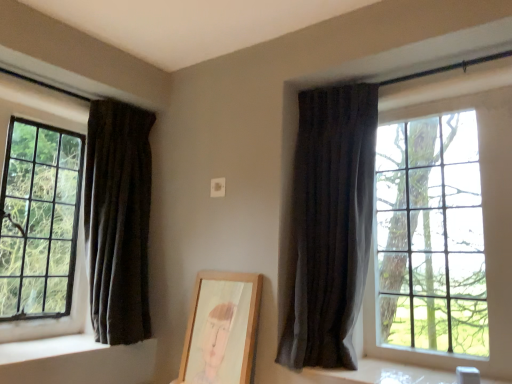
This screenshot has width=512, height=384. What do you see at coordinates (118, 220) in the screenshot? I see `dark fabric curtain at left, which is the second curtain in right-to-left order` at bounding box center [118, 220].

In order to click on dark fabric curtain at left, arranged as the 1th curtain when viewed from the left in this screenshot , I will do `click(118, 220)`.

What is the approximate width of matte black window at left, which ranks as the 1th window in left-to-right order?

matte black window at left, which ranks as the 1th window in left-to-right order, is 3.43 inches wide.

What do you see at coordinates (327, 227) in the screenshot? This screenshot has width=512, height=384. I see `dark fabric curtain at right, marked as the second curtain in a left-to-right arrangement` at bounding box center [327, 227].

Find the location of a particular element. Image resolution: width=512 pixels, height=384 pixels. wooden picture frame at center is located at coordinates (222, 328).

You are a GUI agent. You are given a task and a screenshot of the screen. Output one action in this format:
    pyautogui.click(x=<x>, y=<y>)
    Task: Click on the white smooth window sill at lower right, positioned as the second window sill in left-to-right order
    
    Given the screenshot: What is the action you would take?
    pyautogui.click(x=383, y=374)

Is clear glass window at right, which appears as the 1th window when viewed from the right, turned away from white smooth window sill at lower right, positioned as the second window sill in left-to-right order?

clear glass window at right, which appears as the 1th window when viewed from the right, does not have its back to white smooth window sill at lower right, positioned as the second window sill in left-to-right order.

Which object is positioned more to the right, clear glass window at right, which appears as the 1th window when viewed from the right, or white smooth window sill at lower right, positioned as the second window sill in left-to-right order?

clear glass window at right, which appears as the 1th window when viewed from the right, is more to the right.

Is there a large distance between clear glass window at right, the 2th window from the left, and white smooth window sill at lower right, the first window sill positioned from the right?

No, clear glass window at right, the 2th window from the left, is in close proximity to white smooth window sill at lower right, the first window sill positioned from the right.

Between matte black window at left, placed as the second window when sorted from right to left, and wooden picture frame at center, which one is positioned in front?

wooden picture frame at center is in front.

This screenshot has width=512, height=384. Find the location of `picture frame on the right of matte black window at left, which ranks as the 1th window in left-to-right order`. picture frame on the right of matte black window at left, which ranks as the 1th window in left-to-right order is located at coordinates (222, 328).

Does matte black window at left, which ranks as the 1th window in left-to-right order, have a larger size compared to wooden picture frame at center?

Correct, matte black window at left, which ranks as the 1th window in left-to-right order, is larger in size than wooden picture frame at center.

Is matte black window at left, placed as the second window when sorted from right to left, at the right side of wooden picture frame at center?

No.

Considering the positions of objects white smooth window sill at lower left, which is the first window sill in left-to-right order, and dark fabric curtain at left, which is the second curtain in right-to-left order, in the image provided, who is more to the right, white smooth window sill at lower left, which is the first window sill in left-to-right order, or dark fabric curtain at left, which is the second curtain in right-to-left order,?

dark fabric curtain at left, which is the second curtain in right-to-left order, is more to the right.

Is white smooth window sill at lower left, which is the first window sill in left-to-right order, oriented towards dark fabric curtain at left, which is the second curtain in right-to-left order?

Yes, white smooth window sill at lower left, which is the first window sill in left-to-right order, is aimed at dark fabric curtain at left, which is the second curtain in right-to-left order.

Is white smooth window sill at lower left, placed as the second window sill when sorted from right to left, smaller than dark fabric curtain at left, which is the second curtain in right-to-left order?

Correct, white smooth window sill at lower left, placed as the second window sill when sorted from right to left, occupies less space than dark fabric curtain at left, which is the second curtain in right-to-left order.

Can you see white smooth window sill at lower left, which is the first window sill in left-to-right order, touching dark fabric curtain at left, arranged as the 1th curtain when viewed from the left?

No, white smooth window sill at lower left, which is the first window sill in left-to-right order, is not in contact with dark fabric curtain at left, arranged as the 1th curtain when viewed from the left.

Which of these two, clear glass window at right, which appears as the 1th window when viewed from the right, or wooden picture frame at center, is wider?

With larger width is wooden picture frame at center.

Measure the distance between clear glass window at right, the 2th window from the left, and wooden picture frame at center.

clear glass window at right, the 2th window from the left, is 25.32 inches away from wooden picture frame at center.

Locate an element on the screen. This screenshot has height=384, width=512. picture frame below the clear glass window at right, the 2th window from the left (from a real-world perspective) is located at coordinates (222, 328).

From the image's perspective, is clear glass window at right, which appears as the 1th window when viewed from the right, beneath wooden picture frame at center?

Actually, clear glass window at right, which appears as the 1th window when viewed from the right, appears above wooden picture frame at center in the image.

Is point (113, 174) less distant than point (388, 103)?

That is False.

Are dark fabric curtain at left, arranged as the 1th curtain when viewed from the left, and clear glass window at right, which appears as the 1th window when viewed from the right, located far from each other?

Yes, dark fabric curtain at left, arranged as the 1th curtain when viewed from the left, is far from clear glass window at right, which appears as the 1th window when viewed from the right.

Where is `curtain located behind the clear glass window at right, which appears as the 1th window when viewed from the right`? curtain located behind the clear glass window at right, which appears as the 1th window when viewed from the right is located at coordinates (118, 220).

Can matte black window at left, which ranks as the 1th window in left-to-right order, be found inside clear glass window at right, the 2th window from the left?

No, matte black window at left, which ranks as the 1th window in left-to-right order, is not inside clear glass window at right, the 2th window from the left.

In the scene shown: Could you tell me if clear glass window at right, the 2th window from the left, is turned towards matte black window at left, placed as the second window when sorted from right to left?

No, clear glass window at right, the 2th window from the left, is not turned towards matte black window at left, placed as the second window when sorted from right to left.

Is point (384, 351) in front of point (42, 336)?

Yes, it is in front of point (42, 336).

Considering the sizes of objects clear glass window at right, the 2th window from the left, and matte black window at left, placed as the second window when sorted from right to left, in the image provided, who is bigger, clear glass window at right, the 2th window from the left, or matte black window at left, placed as the second window when sorted from right to left,?

With larger size is clear glass window at right, the 2th window from the left.

From a real-world perspective, is dark fabric curtain at right, which appears as the 1th curtain when viewed from the right, positioned above or below matte black window at left, placed as the second window when sorted from right to left?

dark fabric curtain at right, which appears as the 1th curtain when viewed from the right, is below matte black window at left, placed as the second window when sorted from right to left.

How different are the orientations of dark fabric curtain at right, marked as the second curtain in a left-to-right arrangement, and matte black window at left, placed as the second window when sorted from right to left, in degrees?

The facing directions of dark fabric curtain at right, marked as the second curtain in a left-to-right arrangement, and matte black window at left, placed as the second window when sorted from right to left, are 93.4 degrees apart.

In terms of width, does dark fabric curtain at right, which appears as the 1th curtain when viewed from the right, look wider or thinner when compared to matte black window at left, which ranks as the 1th window in left-to-right order?

In the image, dark fabric curtain at right, which appears as the 1th curtain when viewed from the right, appears to be wider than matte black window at left, which ranks as the 1th window in left-to-right order.

Which object is further away from the camera, dark fabric curtain at right, marked as the second curtain in a left-to-right arrangement, or matte black window at left, which ranks as the 1th window in left-to-right order?

Positioned behind is matte black window at left, which ranks as the 1th window in left-to-right order.

Starting from the clear glass window at right, which appears as the 1th window when viewed from the right, which window sill is the 1st one to the left? Please provide its 2D coordinates.

[(383, 374)]

I want to click on picture frame in front of the matte black window at left, placed as the second window when sorted from right to left, so click(x=222, y=328).

Which object lies further to the anchor point dark fabric curtain at right, marked as the second curtain in a left-to-right arrangement, clear glass window at right, which appears as the 1th window when viewed from the right, or wooden picture frame at center?

wooden picture frame at center is further to dark fabric curtain at right, marked as the second curtain in a left-to-right arrangement.

From the picture: Estimate the real-world distances between objects in this image. Which object is closer to dark fabric curtain at left, arranged as the 1th curtain when viewed from the left, clear glass window at right, the 2th window from the left, or wooden picture frame at center?

wooden picture frame at center lies closer to dark fabric curtain at left, arranged as the 1th curtain when viewed from the left, than the other object.

Considering their positions, is dark fabric curtain at left, arranged as the 1th curtain when viewed from the left, positioned closer to dark fabric curtain at right, marked as the second curtain in a left-to-right arrangement, than matte black window at left, which ranks as the 1th window in left-to-right order?

The object closer to dark fabric curtain at right, marked as the second curtain in a left-to-right arrangement, is dark fabric curtain at left, arranged as the 1th curtain when viewed from the left.

When comparing their distances from clear glass window at right, which appears as the 1th window when viewed from the right, does wooden picture frame at center or white smooth window sill at lower right, positioned as the second window sill in left-to-right order, seem further?

wooden picture frame at center is positioned further to the anchor clear glass window at right, which appears as the 1th window when viewed from the right.

Estimate the real-world distances between objects in this image. Which object is closer to white smooth window sill at lower right, the first window sill positioned from the right, dark fabric curtain at left, which is the second curtain in right-to-left order, or clear glass window at right, which appears as the 1th window when viewed from the right?

Based on the image, clear glass window at right, which appears as the 1th window when viewed from the right, appears to be nearer to white smooth window sill at lower right, the first window sill positioned from the right.

Estimate the real-world distances between objects in this image. Which object is further from white smooth window sill at lower right, the first window sill positioned from the right, matte black window at left, placed as the second window when sorted from right to left, or white smooth window sill at lower left, placed as the second window sill when sorted from right to left?

Among the two, matte black window at left, placed as the second window when sorted from right to left, is located further to white smooth window sill at lower right, the first window sill positioned from the right.

Looking at the image, which one is located further to matte black window at left, which ranks as the 1th window in left-to-right order, dark fabric curtain at right, which appears as the 1th curtain when viewed from the right, or white smooth window sill at lower left, placed as the second window sill when sorted from right to left?

Among the two, dark fabric curtain at right, which appears as the 1th curtain when viewed from the right, is located further to matte black window at left, which ranks as the 1th window in left-to-right order.

Which object lies nearer to the anchor point white smooth window sill at lower right, the first window sill positioned from the right, clear glass window at right, the 2th window from the left, or white smooth window sill at lower left, placed as the second window sill when sorted from right to left?

Among the two, clear glass window at right, the 2th window from the left, is located nearer to white smooth window sill at lower right, the first window sill positioned from the right.

At what (x,y) coordinates should I click in order to perform the action: click on curtain between white smooth window sill at lower left, placed as the second window sill when sorted from right to left, and wooden picture frame at center from left to right. Please return your answer as a coordinate pair (x, y). The image size is (512, 384). Looking at the image, I should click on (118, 220).

You are a GUI agent. You are given a task and a screenshot of the screen. Output one action in this format:
    pyautogui.click(x=<x>, y=<y>)
    Task: Click on the curtain between dark fabric curtain at left, which is the second curtain in right-to-left order, and clear glass window at right, which appears as the 1th window when viewed from the right, in the horizontal direction
    This screenshot has width=512, height=384.
    Given the screenshot: What is the action you would take?
    tap(327, 227)

Locate an element on the screen. This screenshot has height=384, width=512. picture frame between white smooth window sill at lower left, which is the first window sill in left-to-right order, and white smooth window sill at lower right, positioned as the second window sill in left-to-right order, from left to right is located at coordinates pos(222,328).

Identify the location of curtain between matte black window at left, which ranks as the 1th window in left-to-right order, and dark fabric curtain at right, which appears as the 1th curtain when viewed from the right. (118, 220).